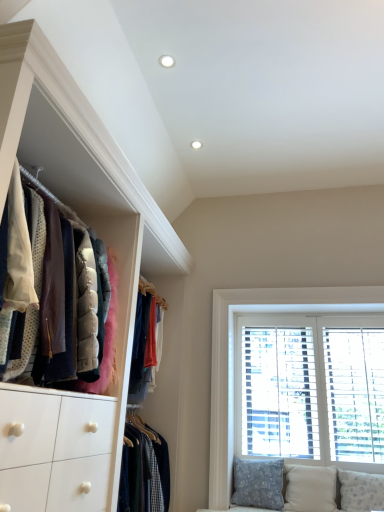
Question: Is velvet jackets at left in front of or behind white textured pillow at lower right, acting as the third pillow starting from the left, in the image?

Choices:
 (A) front
 (B) behind

Answer: (A)

Question: From the image's perspective, is velvet jackets at left positioned above or below white textured pillow at lower right, the first pillow positioned from the right?

Choices:
 (A) above
 (B) below

Answer: (A)

Question: Based on their relative distances, which object is farther from the patterned fabric pillow at lower right, the 1th pillow in the left-to-right sequence?

Choices:
 (A) velvet jackets at left
 (B) beige fabric pillow at lower right, the second pillow when ordered from left to right
 (C) white textured pillow at lower right, the first pillow positioned from the right
 (D) white wood window at right

Answer: (A)

Question: Estimate the real-world distances between objects in this image. Which object is closer to the patterned fabric pillow at lower right, the 1th pillow in the left-to-right sequence?

Choices:
 (A) velvet jackets at left
 (B) white wood window at right
 (C) white textured pillow at lower right, acting as the third pillow starting from the left
 (D) beige fabric pillow at lower right, the 2th pillow viewed from the right

Answer: (D)